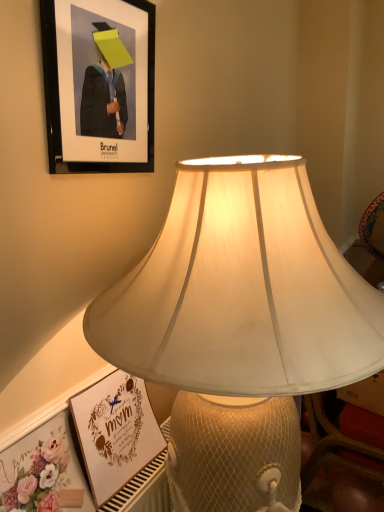
Question: Is matte white lampshade at center in front of or behind black matte picture frame at upper left, marked as the 2th picture frame in a bottom-to-top arrangement, in the image?

Choices:
 (A) front
 (B) behind

Answer: (A)

Question: Would you say matte white lampshade at center is to the left or to the right of black matte picture frame at upper left, marked as the 1th picture frame in a top-to-bottom arrangement, in the picture?

Choices:
 (A) right
 (B) left

Answer: (A)

Question: Which object is the farthest from the floral paper at lower left?

Choices:
 (A) matte white frame at lower left, the 1th picture frame when ordered from bottom to top
 (B) black matte picture frame at upper left, marked as the 2th picture frame in a bottom-to-top arrangement
 (C) matte white lampshade at center

Answer: (B)

Question: Which is farther from the matte white frame at lower left, the 1th picture frame when ordered from bottom to top?

Choices:
 (A) floral paper at lower left
 (B) black matte picture frame at upper left, marked as the 1th picture frame in a top-to-bottom arrangement
 (C) matte white lampshade at center

Answer: (B)